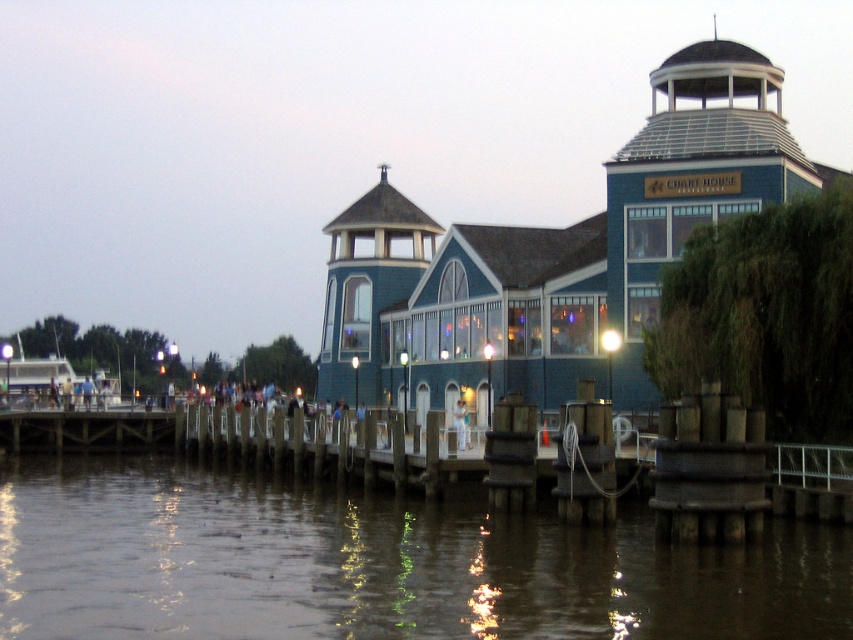
You are standing on the dock and want to place a small picnic basket on the ground. The brown murky water at lower center and the white fabric dress at center are both in your view. Which area is more suitable for placing the picnic basket based on their sizes?

The brown murky water at lower center is larger in size than the white fabric dress at center, so placing the picnic basket on the brown murky water at lower center would be more suitable due to its larger area.

You are a tourist standing on the dock and see the brown murky water at lower center and the white glossy boat at lower left. Which object is closer to your left side?

The white glossy boat at lower left is closer to your left side because it is positioned to the left of the brown murky water at lower center.